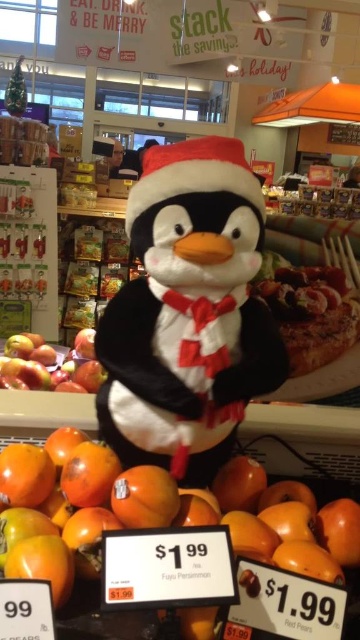
Question: Which object is farther from the camera taking this photo?

Choices:
 (A) glossy red apple at left
 (B) orange matte fuji persimmon at center
 (C) white plush penguin at center

Answer: (A)

Question: Is orange matte fuji persimmon at center above glossy red apple at left?

Choices:
 (A) yes
 (B) no

Answer: (B)

Question: Does white plush penguin at center have a smaller size compared to orange matte fuji persimmon at center?

Choices:
 (A) no
 (B) yes

Answer: (A)

Question: Which object is closer to the camera taking this photo?

Choices:
 (A) orange matte fuji persimmon at center
 (B) white plush penguin at center

Answer: (A)

Question: Is white plush penguin at center thinner than glossy red apple at left?

Choices:
 (A) no
 (B) yes

Answer: (B)

Question: Based on their relative distances, which object is farther from the white plush penguin at center?

Choices:
 (A) glossy red apple at left
 (B) orange matte fuji persimmon at center

Answer: (A)